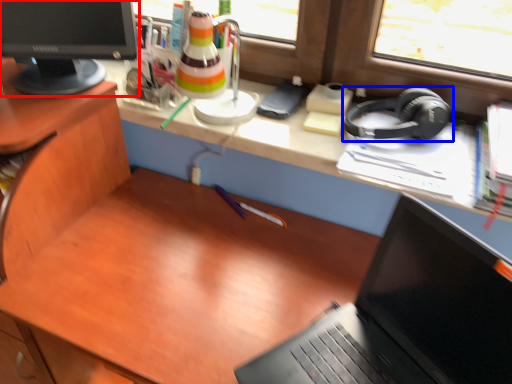
Question: Which object appears closest to the camera in this image, computer monitor (highlighted by a red box) or headphones (highlighted by a blue box)?

Choices:
 (A) computer monitor
 (B) headphones

Answer: (A)